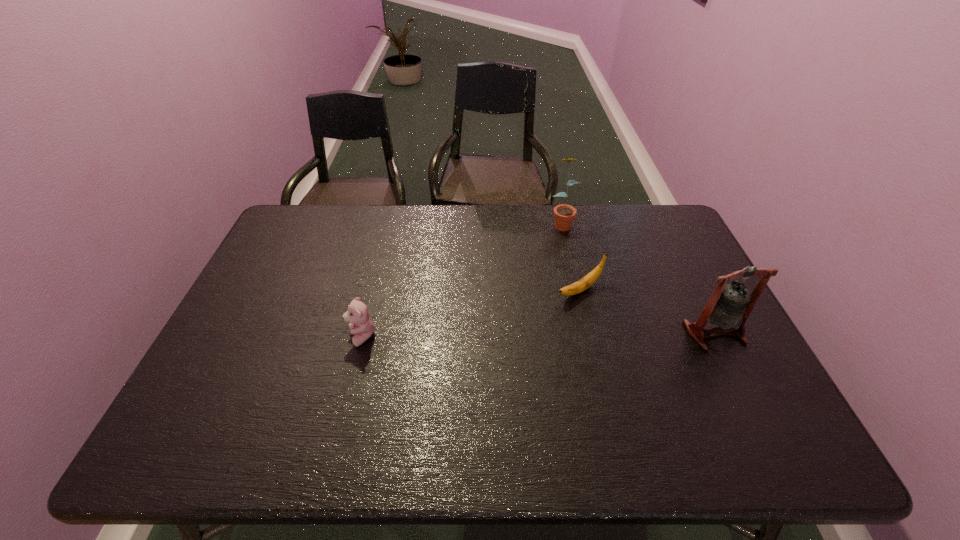
Identify the location of vacant region between the teddy bear and the farthest object. Image resolution: width=960 pixels, height=540 pixels. (462, 280).

The height and width of the screenshot is (540, 960). What are the coordinates of `vacant space that's between the rightmost object and the second shortest object` in the screenshot? It's located at (539, 335).

Where is `free space between the teddy bear and the bell`? The height and width of the screenshot is (540, 960). free space between the teddy bear and the bell is located at coordinates (539, 335).

I want to click on object that is the nearest to the second farthest object, so click(x=730, y=305).

Select which object is the third closest to the bell. Please provide its 2D coordinates. Your answer should be formatted as a tuple, i.e. [(x, y)], where the tuple contains the x and y coordinates of a point satisfying the conditions above.

[(360, 324)]

Locate an element on the screen. This screenshot has width=960, height=540. free space that satisfies the following two spatial constraints: 1. on the front side of the rightmost object; 2. on the left side of the shortest object is located at coordinates (590, 333).

In order to click on free location that satisfies the following two spatial constraints: 1. on the front side of the farthest object; 2. on the left side of the bell in this screenshot , I will do `click(587, 333)`.

The height and width of the screenshot is (540, 960). I want to click on vacant space that satisfies the following two spatial constraints: 1. on the front side of the sunflower; 2. on the left side of the rightmost object, so click(587, 333).

In order to click on vacant region that satisfies the following two spatial constraints: 1. on the front side of the bell; 2. on the left side of the shortest object in this screenshot , I will do `click(590, 333)`.